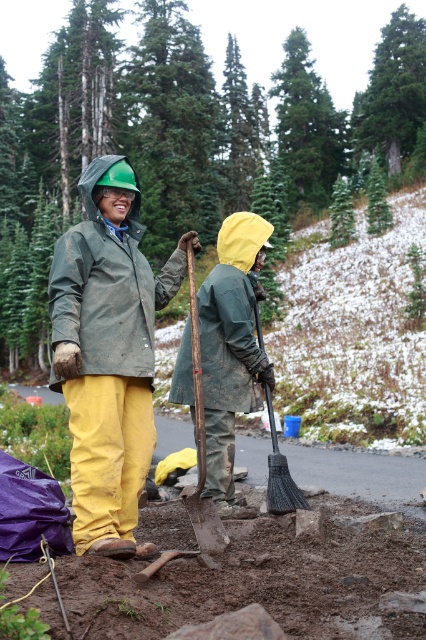
The width and height of the screenshot is (426, 640). Describe the element at coordinates (201, 448) in the screenshot. I see `rusty metal shovel at center` at that location.

Does rusty metal shovel at center have a lesser height compared to black plastic shovel at lower center?

In fact, rusty metal shovel at center may be taller than black plastic shovel at lower center.

At what (x,y) coordinates should I click in order to perform the action: click on rusty metal shovel at center. Please return your answer as a coordinate pair (x, y). The image size is (426, 640). Looking at the image, I should click on (201, 448).

Does green matte raincoat at center appear under black plastic shovel at lower center?

No.

Is green matte raincoat at center behind black plastic shovel at lower center?

That is False.

Identify the location of green matte raincoat at center. (109, 353).

From the picture: Who is lower down, green matte raincoat at center or rusty metal shovel at center?

rusty metal shovel at center

Does point (132, 461) come behind point (203, 513)?

That is False.

This screenshot has width=426, height=640. Find the location of `green matte raincoat at center`. green matte raincoat at center is located at coordinates (109, 353).

This screenshot has width=426, height=640. Find the location of `green matte raincoat at center`. green matte raincoat at center is located at coordinates (109, 353).